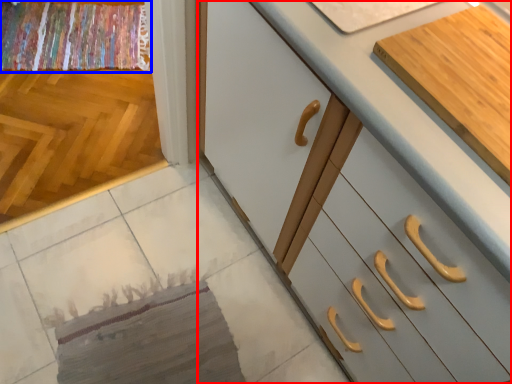
Question: Among these objects, which one is nearest to the camera, cabinetry (highlighted by a red box) or blanket (highlighted by a blue box)?

Choices:
 (A) cabinetry
 (B) blanket

Answer: (A)